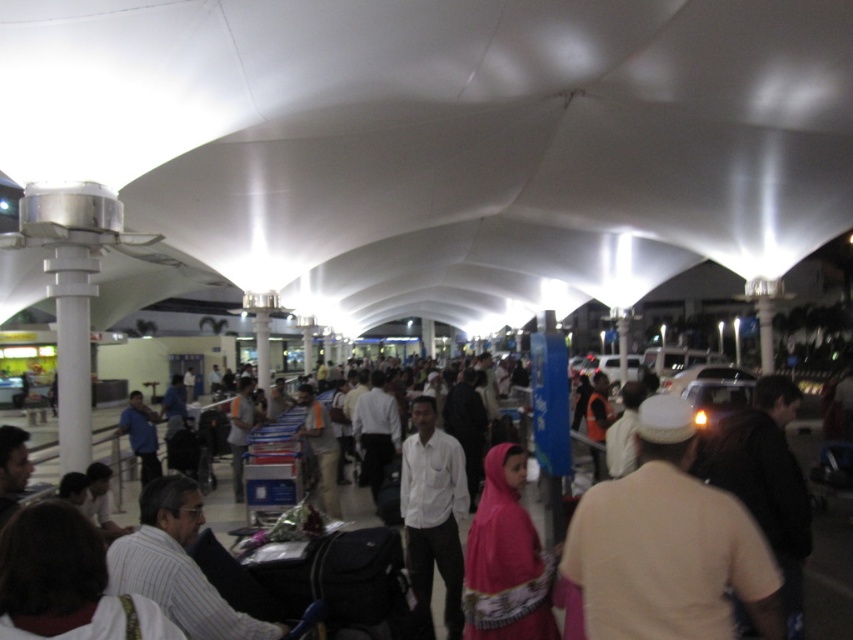
Consider the image. You are standing in the airport terminal and see a person wearing a white striped shirt at lower left and a traveler carrying a brown fabric backpack at right. Which object is positioned more to the left side of the scene?

The white striped shirt at lower left is positioned more to the left side of the scene compared to the brown fabric backpack at right.

You are a traveler who just arrived at the airport terminal. You notice a beige cotton shirt at center and a brown fabric backpack at right. Which item is smaller in size?

The beige cotton shirt at center is smaller in size compared to the brown fabric backpack at right.

You are standing at the entrance of the airport terminal and see two points marked in the scene. The first point is at coordinates point (x=761, y=403) and the second is at point (x=474, y=513). Which point is closer to you as you face the terminal?

Point (x=761, y=403) is in front of point (x=474, y=513), so it is closer to you as you face the terminal.